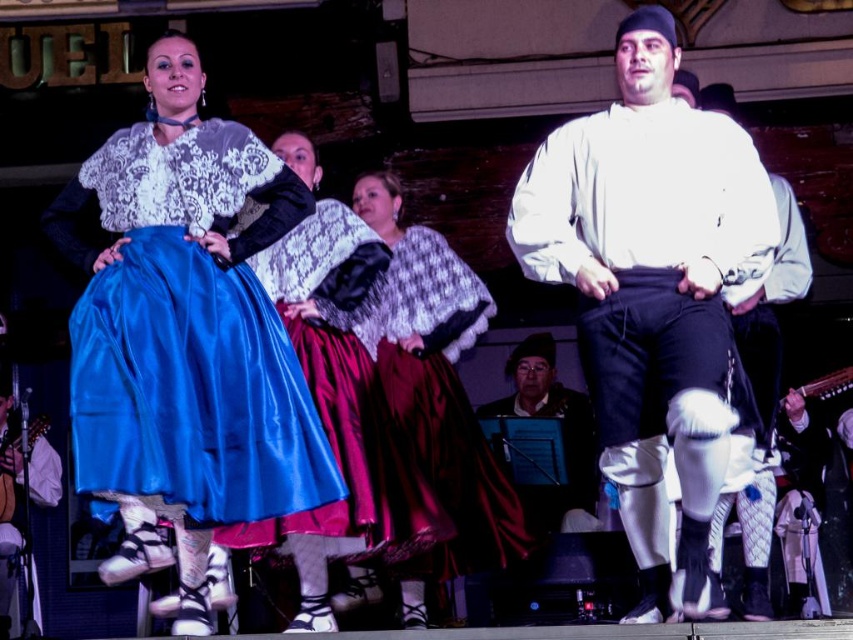
Question: Estimate the real-world distances between objects in this image. Which object is farther from the white cotton shirt at center?

Choices:
 (A) velvet maroon skirt at center
 (B) matte black hat at center

Answer: (B)

Question: Which object appears closest to the camera in this image?

Choices:
 (A) white cotton shirt at center
 (B) matte black hat at center

Answer: (A)

Question: Does shiny blue skirt at center appear on the right side of white matte shirt at center?

Choices:
 (A) yes
 (B) no

Answer: (B)

Question: Which object is the closest to the white matte shirt at center?

Choices:
 (A) shiny blue skirt at center
 (B) white cotton shirt at center

Answer: (B)

Question: Is the position of shiny blue skirt at center less distant than that of matte black hat at center?

Choices:
 (A) yes
 (B) no

Answer: (A)

Question: Can you confirm if white matte shirt at center is positioned to the left of velvet maroon skirt at center?

Choices:
 (A) no
 (B) yes

Answer: (A)